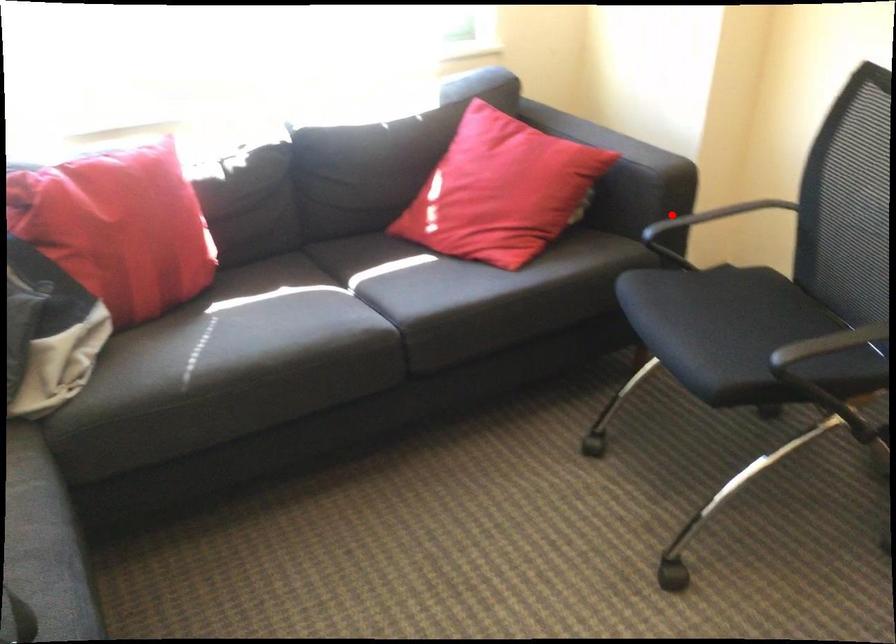
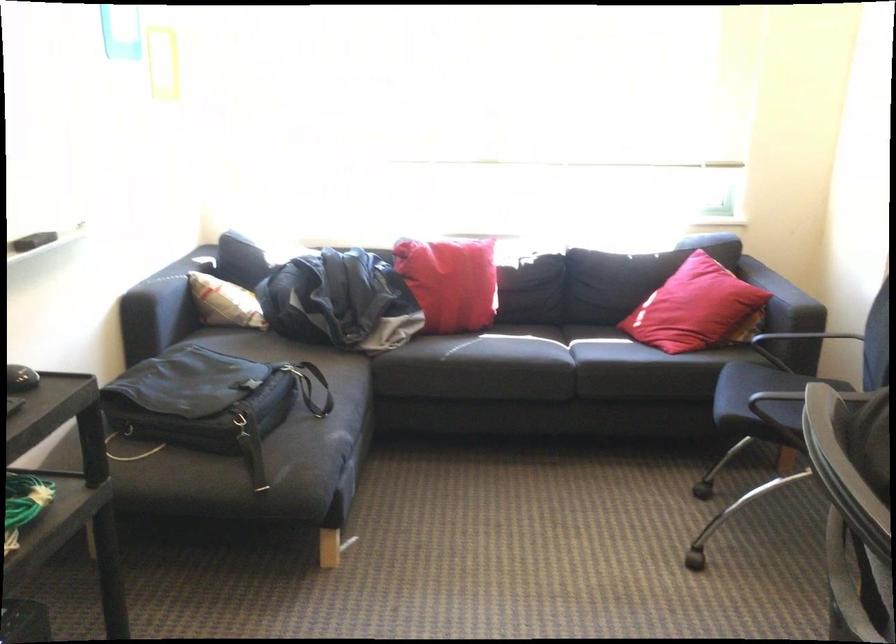
The point at the highlighted location is marked in the first image. Where is the corresponding point in the second image?

(802, 337)